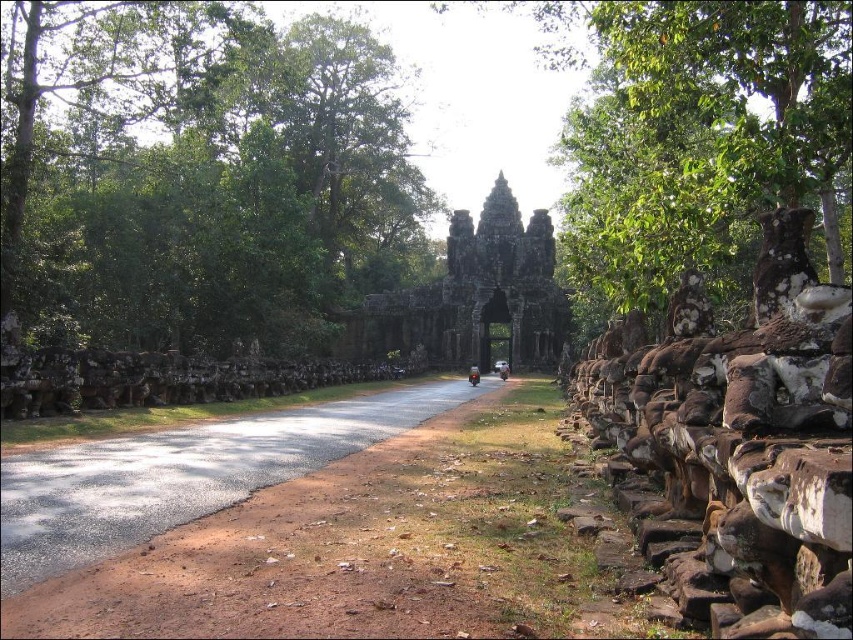
Does green leafy trees at upper left have a larger size compared to dark stone gate at center?

Correct, green leafy trees at upper left is larger in size than dark stone gate at center.

Does green leafy trees at upper left appear on the left side of dark stone gate at center?

Yes, green leafy trees at upper left is to the left of dark stone gate at center.

Describe the element at coordinates (225, 193) in the screenshot. I see `green leafy trees at upper left` at that location.

Locate an element on the screen. This screenshot has height=640, width=853. green leafy trees at upper left is located at coordinates (225, 193).

Between green leafy trees at upper left and shiny red motorcycle at center, which one is positioned lower?

shiny red motorcycle at center is below.

Does green leafy trees at upper left appear on the right side of shiny red motorcycle at center?

No, green leafy trees at upper left is not to the right of shiny red motorcycle at center.

What do you see at coordinates (225, 193) in the screenshot?
I see `green leafy trees at upper left` at bounding box center [225, 193].

The image size is (853, 640). I want to click on green leafy trees at upper left, so click(225, 193).

Is green leafy trees at upper left smaller than asphalt road at center?

Actually, green leafy trees at upper left might be larger than asphalt road at center.

Is green leafy trees at upper left to the left of asphalt road at center from the viewer's perspective?

Yes, green leafy trees at upper left is to the left of asphalt road at center.

This screenshot has width=853, height=640. What do you see at coordinates (225, 193) in the screenshot?
I see `green leafy trees at upper left` at bounding box center [225, 193].

Locate an element on the screen. green leafy trees at upper left is located at coordinates (225, 193).